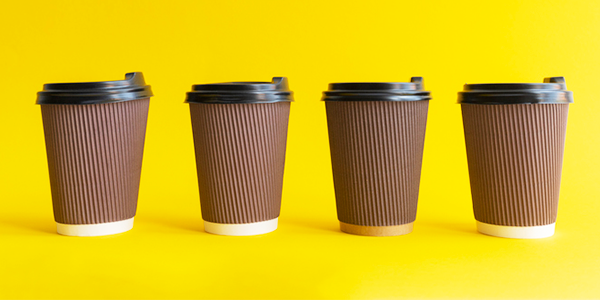
Identify the location of disposable lid for cup. The height and width of the screenshot is (300, 600). 112,87, 225,91, 369,89, 510,89.